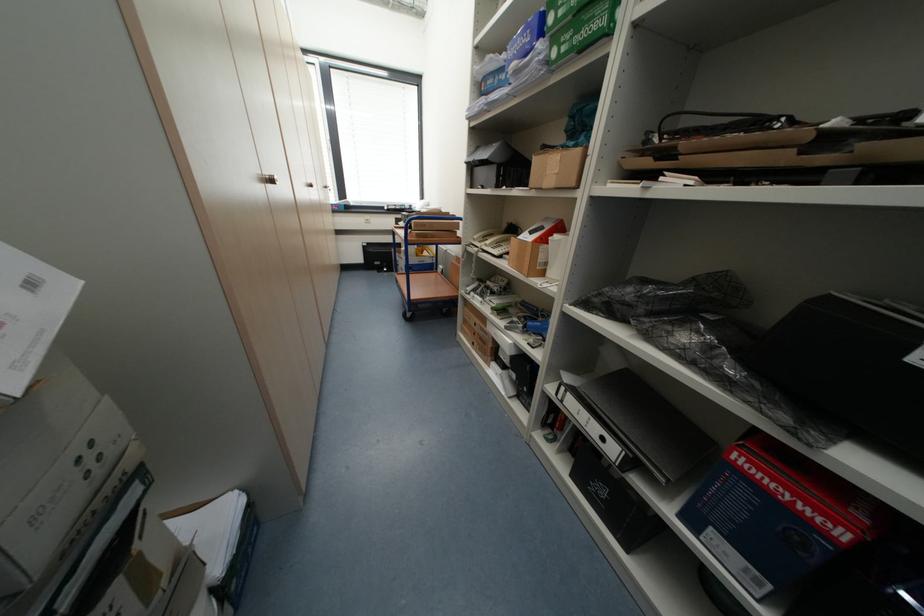
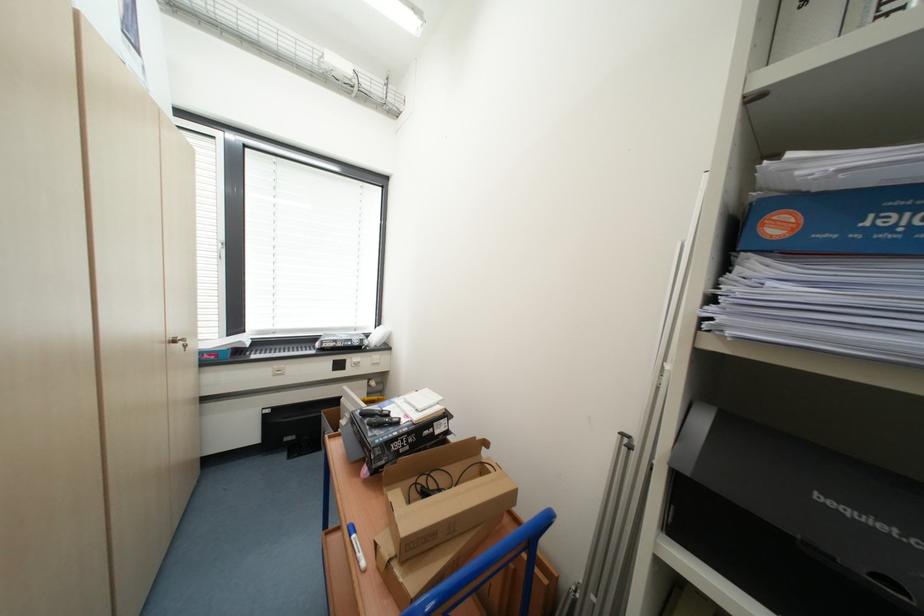
Question: In a continuous first-person perspective shot, in which direction is the camera moving?

Choices:
 (A) Left
 (B) Right
 (C) Forward
 (D) Backward

Answer: (C)